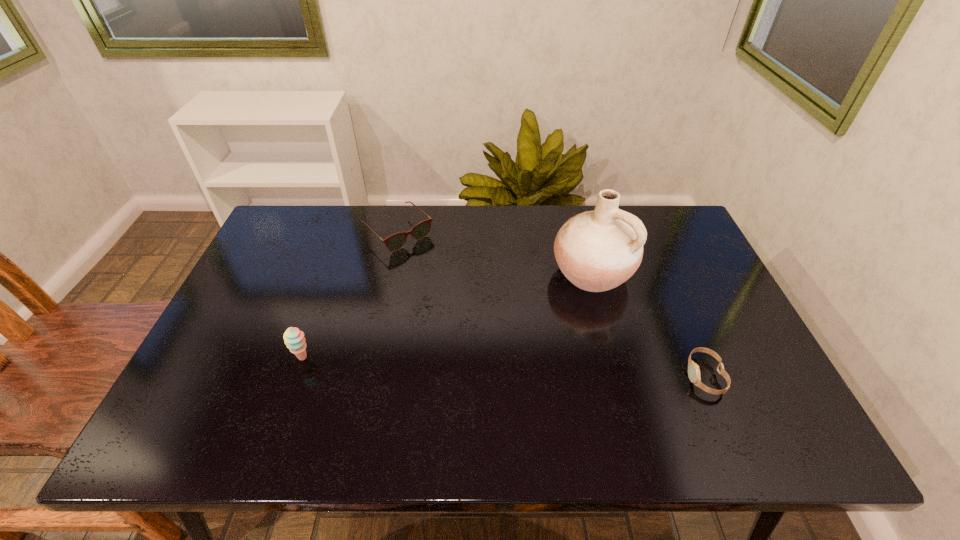
Locate an element on the screen. This screenshot has height=540, width=960. the leftmost object is located at coordinates (294, 339).

This screenshot has height=540, width=960. Find the location of `sherbert`. sherbert is located at coordinates (294, 339).

Find the location of a particular element. the rightmost object is located at coordinates (693, 369).

Where is `the shortest object`? The height and width of the screenshot is (540, 960). the shortest object is located at coordinates (693, 369).

Find the location of a particular element. The image size is (960, 540). the tallest object is located at coordinates (598, 250).

Locate an element on the screen. the third object from left to right is located at coordinates (598, 250).

Find the location of a particular element. The image size is (960, 540). the second shortest object is located at coordinates (395, 242).

You are a GUI agent. You are given a task and a screenshot of the screen. Output one action in this format:
    pyautogui.click(x=<x>, y=<y>)
    Task: Click on the spectacles
    The image size is (960, 540).
    Given the screenshot: What is the action you would take?
    pyautogui.click(x=395, y=242)

Image resolution: width=960 pixels, height=540 pixels. In order to click on free location located on the back of the leftmost object in this screenshot , I will do `click(332, 272)`.

The height and width of the screenshot is (540, 960). What are the coordinates of `free spot located on the face of the rightmost object` in the screenshot? It's located at (607, 376).